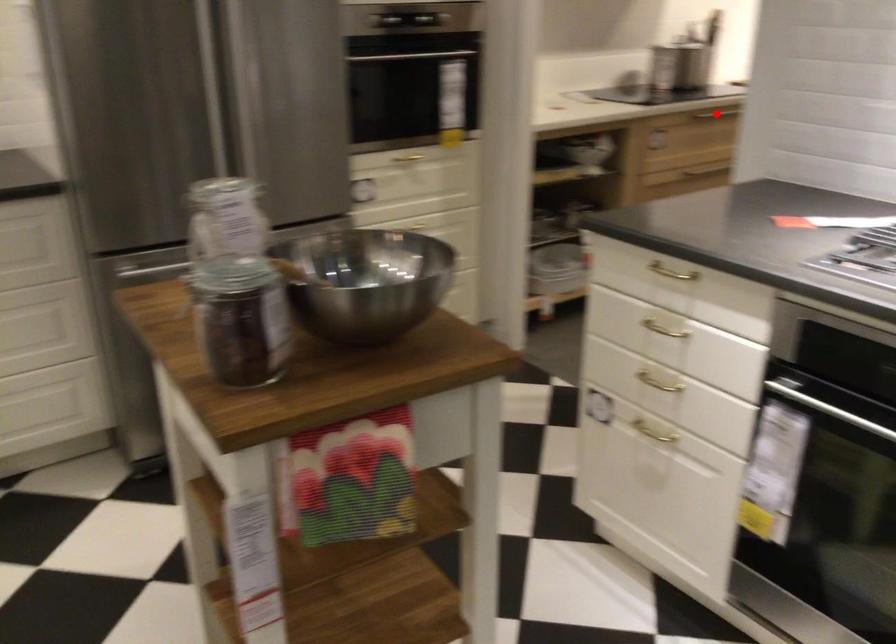
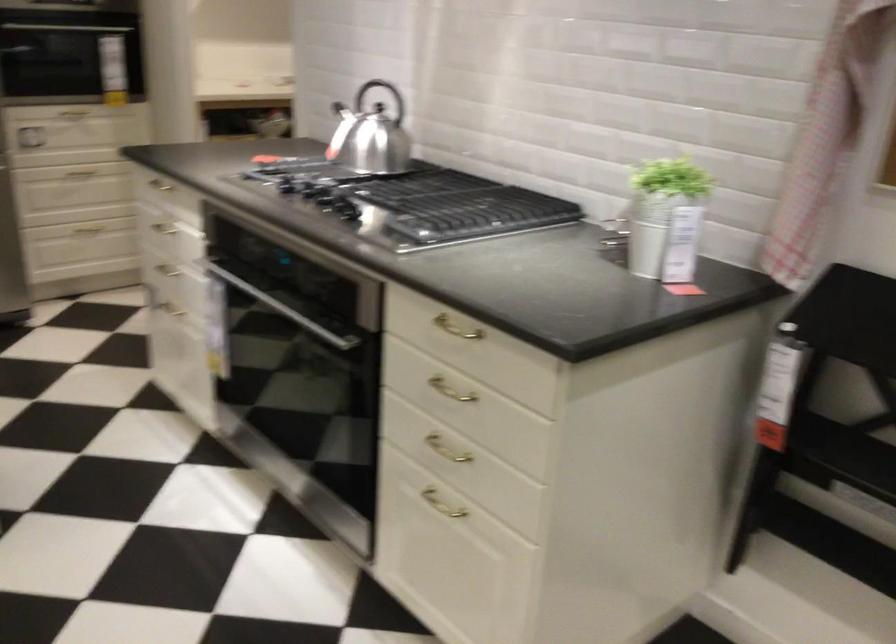
Question: I am providing you with two images of the same scene from different viewpoints. A red point is marked on the first image. Can you still see the location of the red point in image 2?

Choices:
 (A) Yes
 (B) No

Answer: (B)